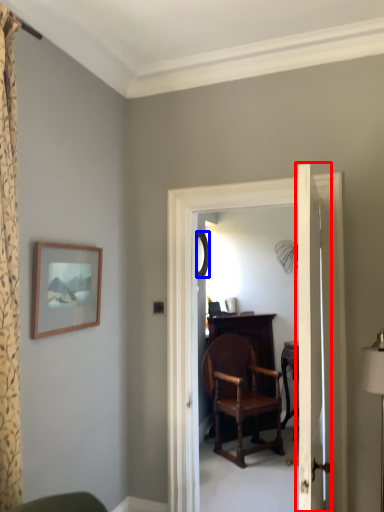
Question: Which object appears closest to the camera in this image, door (highlighted by a red box) or mirror (highlighted by a blue box)?

Choices:
 (A) door
 (B) mirror

Answer: (A)